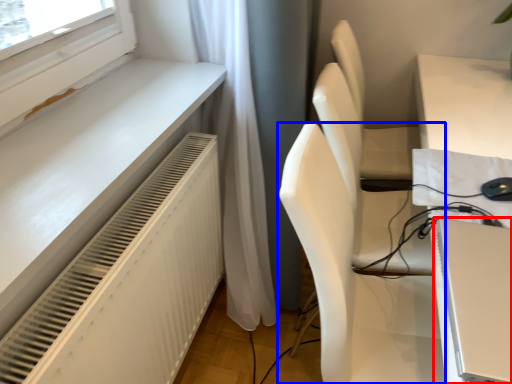
Question: Which object appears farthest to the camera in this image, computer (highlighted by a red box) or chair (highlighted by a blue box)?

Choices:
 (A) computer
 (B) chair

Answer: (B)